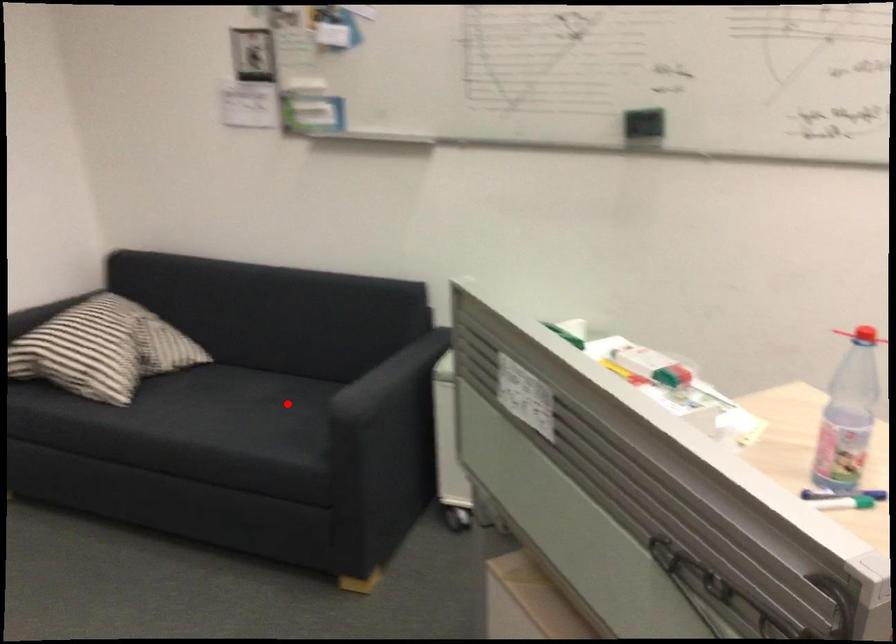
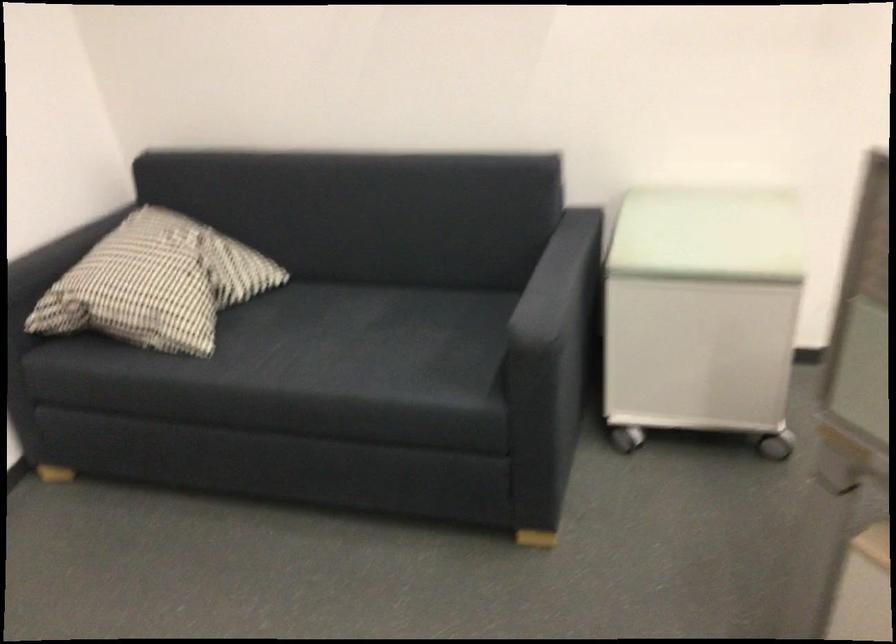
Question: I am providing you with two images of the same scene from different viewpoints. Image1 has a red point marked. In image2, the corresponding 3D location appears at what relative position? Reply with the corresponding letter.

Choices:
 (A) Closer
 (B) Farther

Answer: (A)